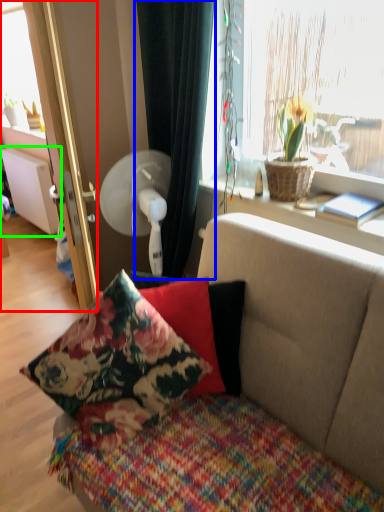
Question: Considering the real-world distances, which object is farthest from screen door (highlighted by a red box)? curtain (highlighted by a blue box) or radiator (highlighted by a green box)?

Choices:
 (A) curtain
 (B) radiator

Answer: (B)